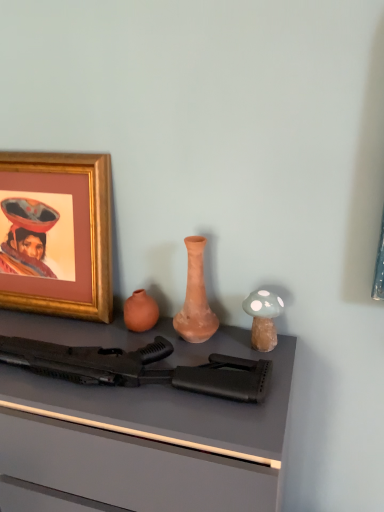
Locate an element on the screen. Image resolution: width=384 pixels, height=512 pixels. free point above matte black rifle at center (from a real-world perspective) is located at coordinates (114, 343).